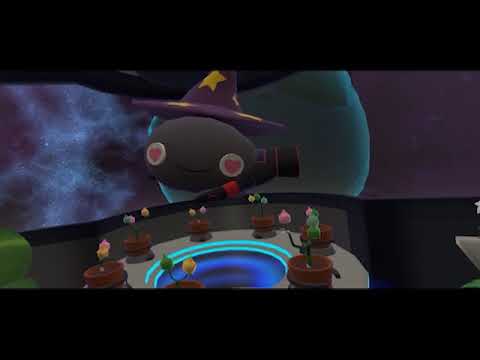
You are a GUI agent. You are given a task and a screenshot of the screen. Output one action in this format:
    pyautogui.click(x=<x>, y=<y>)
    Task: Click on the plant holder
    Image resolution: width=480 pixels, height=360 pixels.
    Given the screenshot: What is the action you would take?
    click(326, 273)